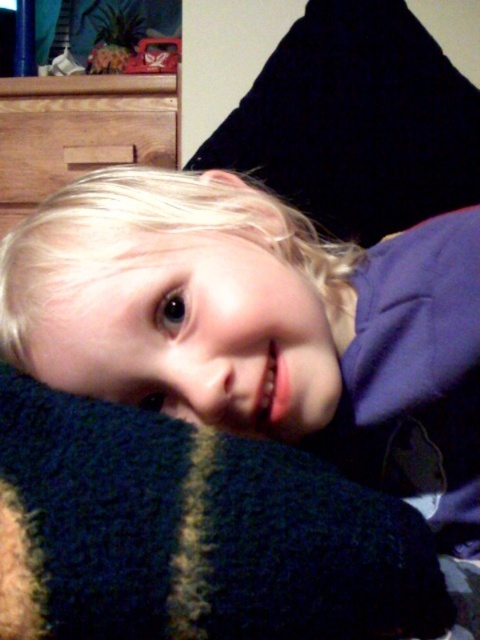
You are a photographer adjusting your camera to focus on the blonde hair at center and the dark blue knitted blanket at center. Which object should you focus on first to ensure the closest object is sharp?

You should focus on the blonde hair at center first because it is closer to the viewer than the dark blue knitted blanket at center.

You are a photographer setting up a shot of the child. You need to ensure the blonde hair at center and dark blue knitted blanket at center are both visible. Which object should be placed higher in the frame to achieve this?

The blonde hair at center should be placed higher in the frame since it is already positioned above the dark blue knitted blanket at center.